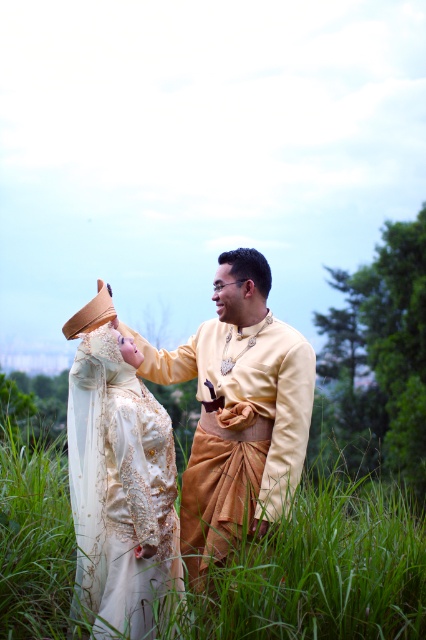
You are a photographer preparing to take a photo of the couple in the scene. You notice two items with matte gold fabric at center and matte gold dress at center. Which item is located to the right of the other?

The matte gold fabric at center is positioned on the right side of matte gold dress at center.

Based on the photo, you are a photographer setting up for a traditional wedding photo. You need to ensure the couple stands on the green grass at center while avoiding the matte gold fabric at center. Based on the scene description, which area is wider and can accommodate both the couple comfortably?

The green grass at center is wider than the matte gold fabric at center, so the couple should stand on the green grass at center to have enough space.

You are a photographer trying to capture the couple in the scene. To ensure the green grass at center is perfectly framed in your shot, where should you position your camera? Please provide the coordinates based on the image grid system where the bottom left corner is the origin point.

The green grass at center is located at coordinates 0.897 on the x axis and 0.751 on the y axis, so position the camera to focus on that point.